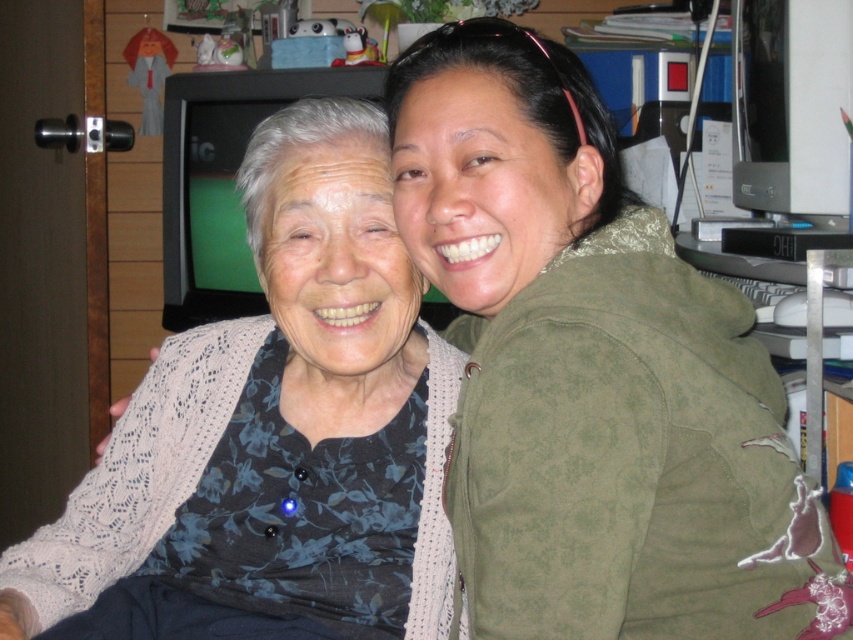
Question: Can you confirm if matte black sweater at left is smaller than floral knit cardigan at center?

Choices:
 (A) no
 (B) yes

Answer: (A)

Question: Does matte black sweater at left appear on the right side of floral knit cardigan at center?

Choices:
 (A) yes
 (B) no

Answer: (A)

Question: Which of the following is the farthest from the observer?

Choices:
 (A) (317, 358)
 (B) (474, 58)

Answer: (A)

Question: Among these points, which one is nearest to the camera?

Choices:
 (A) (198, 442)
 (B) (500, 547)

Answer: (B)

Question: Where is matte black sweater at left located in relation to floral knit cardigan at center in the image?

Choices:
 (A) above
 (B) below

Answer: (A)